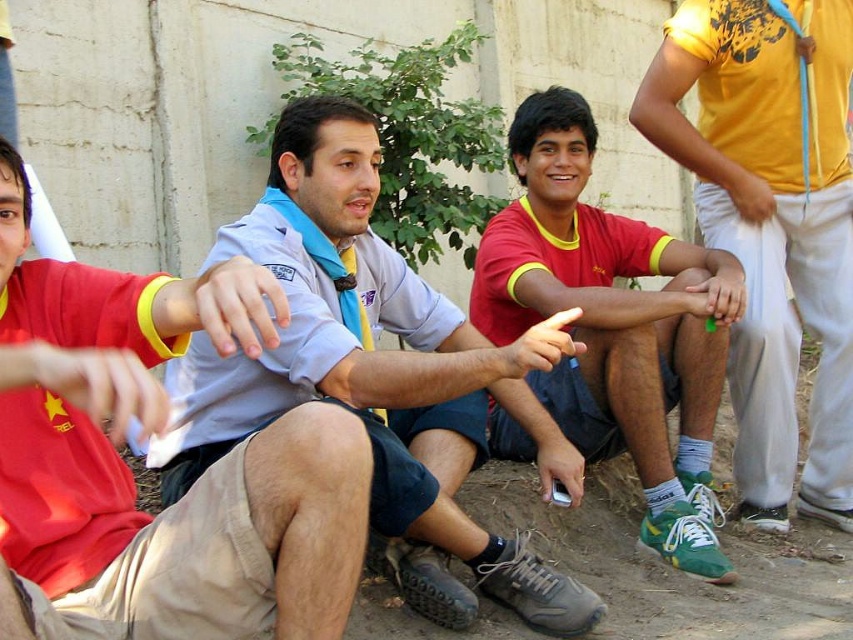
Between yellow cotton shirt at upper right and red/yellow jersey at center, which one appears on the right side from the viewer's perspective?

yellow cotton shirt at upper right

The image size is (853, 640). Describe the element at coordinates (770, 227) in the screenshot. I see `yellow cotton shirt at upper right` at that location.

Between point (785, 220) and point (593, 412), which one is positioned behind?

Point (785, 220)

The height and width of the screenshot is (640, 853). Find the location of `yellow cotton shirt at upper right`. yellow cotton shirt at upper right is located at coordinates (770, 227).

Can you confirm if light blue fabric shirt at center is shorter than yellow cotton shirt at upper right?

Correct, light blue fabric shirt at center is not as tall as yellow cotton shirt at upper right.

Who is shorter, light blue fabric shirt at center or yellow cotton shirt at upper right?

light blue fabric shirt at center is shorter.

Is point (178, 401) closer to viewer compared to point (810, 136)?

Yes, point (178, 401) is in front of point (810, 136).

At what (x,y) coordinates should I click in order to perform the action: click on light blue fabric shirt at center. Please return your answer as a coordinate pair (x, y). Looking at the image, I should click on (373, 364).

Can you confirm if light blue fabric shirt at center is taller than red/yellow jersey at center?

Incorrect, light blue fabric shirt at center's height is not larger of red/yellow jersey at center's.

Can you confirm if light blue fabric shirt at center is positioned below red/yellow jersey at center?

Correct, light blue fabric shirt at center is located below red/yellow jersey at center.

At what (x,y) coordinates should I click in order to perform the action: click on light blue fabric shirt at center. Please return your answer as a coordinate pair (x, y). This screenshot has width=853, height=640. Looking at the image, I should click on (373, 364).

The height and width of the screenshot is (640, 853). What are the coordinates of `light blue fabric shirt at center` in the screenshot? It's located at point(373,364).